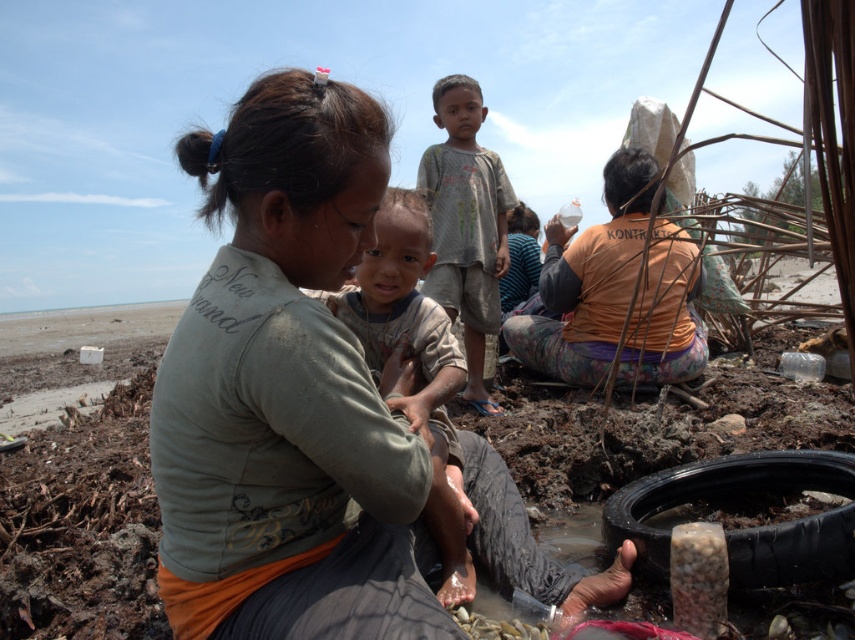
Is point (282, 376) farther from viewer compared to point (464, 305)?

No, it is in front of (464, 305).

This screenshot has height=640, width=855. In order to click on matte green shirt at center in this screenshot , I will do `click(289, 394)`.

Who is positioned more to the right, matte green shirt at center or black rubber tire at lower right?

black rubber tire at lower right

Who is more forward, (354, 620) or (773, 476)?

Positioned in front is point (354, 620).

Identify the location of matte green shirt at center. (289, 394).

Which is above, dirty cloth shirt at center or gray cotton shirt at center?

gray cotton shirt at center

Which is more to the left, dirty cloth shirt at center or gray cotton shirt at center?

dirty cloth shirt at center

Between point (441, 467) and point (453, 150), which one is positioned behind?

Positioned behind is point (453, 150).

In order to click on dirty cloth shirt at center in this screenshot , I will do `click(416, 364)`.